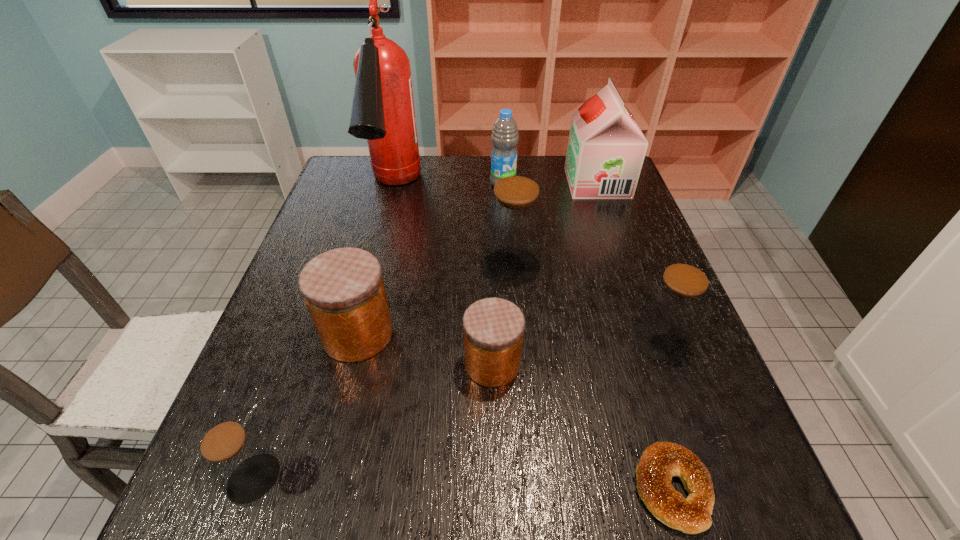
In the image, there is a desktop. Where is `free region at the left edge`? The image size is (960, 540). free region at the left edge is located at coordinates (313, 351).

Locate an element on the screen. The height and width of the screenshot is (540, 960). free spot at the right edge of the desktop is located at coordinates (627, 248).

Identify the location of empty space between the blue water bottle and the tan bagel. This screenshot has height=540, width=960. (588, 336).

Find the location of a particular element. blank region between the blue water bottle and the tallest object is located at coordinates (448, 187).

You are a GUI agent. You are given a task and a screenshot of the screen. Output one action in this format:
    pyautogui.click(x=<x>, y=<y>)
    Task: Click on the vacant region between the rightmost brown jar and the eighth shortest object
    The width and height of the screenshot is (960, 540).
    Given the screenshot: What is the action you would take?
    (x=628, y=261)

What are the coordinates of `empty location between the bagel and the right orange jar` in the screenshot? It's located at (582, 426).

Locate an element on the screen. Image resolution: width=960 pixels, height=540 pixels. free space that is in between the water bottle and the fire extinguisher is located at coordinates (448, 187).

At what (x,y) coordinates should I click in order to perform the action: click on vacant area between the blue water bottle and the rightmost jar. Please return your answer as a coordinate pair (x, y). The width and height of the screenshot is (960, 540). Looking at the image, I should click on (582, 261).

You are a GUI agent. You are given a task and a screenshot of the screen. Output one action in this format:
    pyautogui.click(x=<x>, y=<y>)
    Task: Click on the vacant area that lies between the second smallest brown jar and the soya milk
    This screenshot has width=960, height=540.
    Given the screenshot: What is the action you would take?
    point(628,261)

The width and height of the screenshot is (960, 540). In order to click on vacant space that's between the eighth shortest object and the right orange jar in this screenshot , I will do [544, 273].